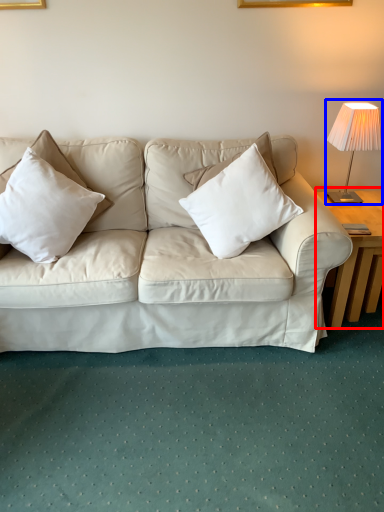
Question: Which of the following is the closest to the observer, table (highlighted by a red box) or table lamp (highlighted by a blue box)?

Choices:
 (A) table
 (B) table lamp

Answer: (A)